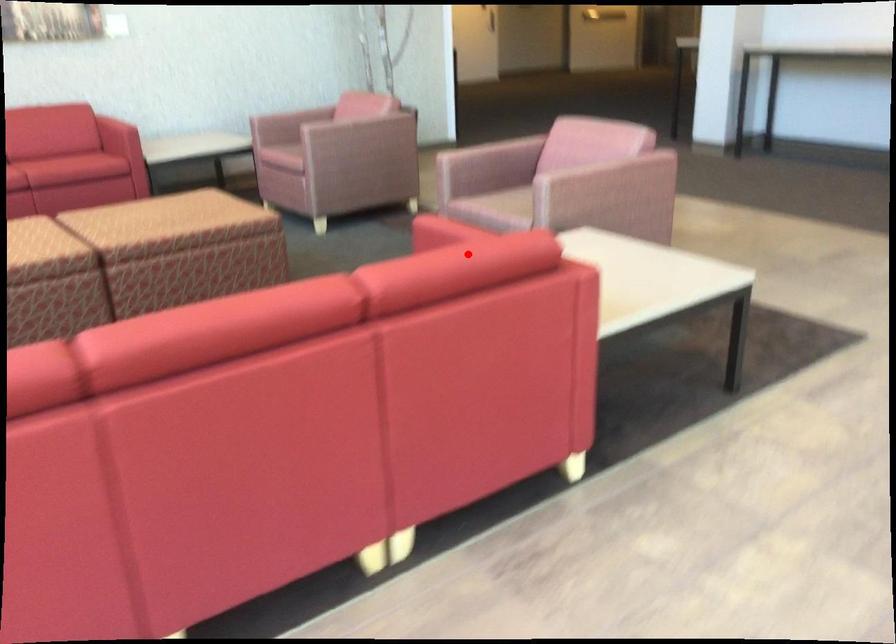
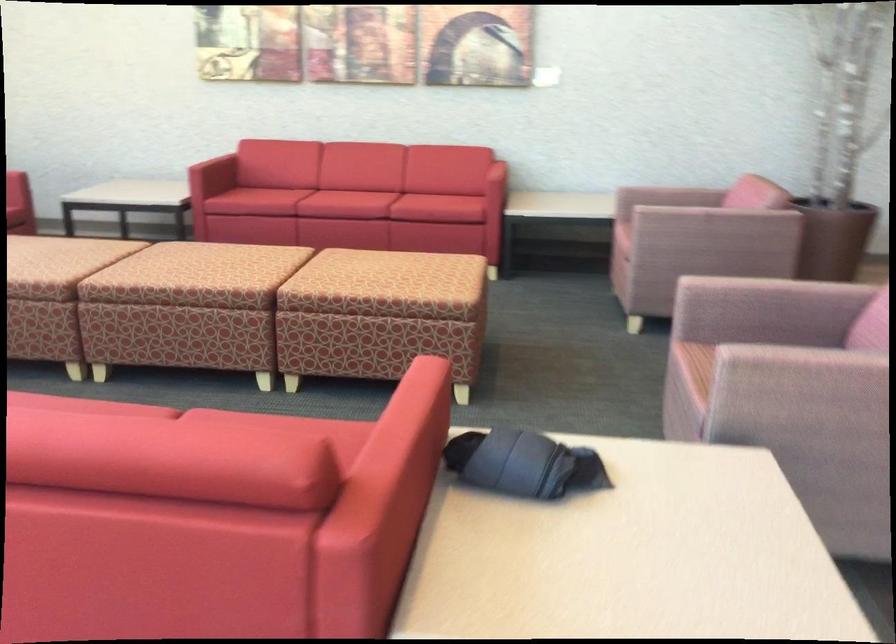
Where in the second image is the point corresponding to the highlighted location from the first image?

(173, 442)